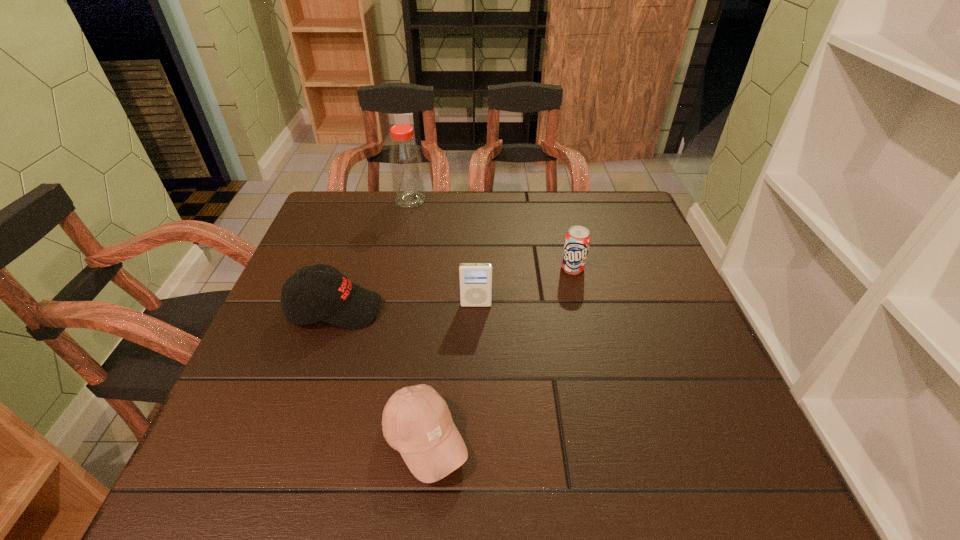
Identify the location of blank space located on the front-facing side of the iPod. (474, 459).

Identify the location of vacant area situated on the front of the rightmost object. (592, 353).

Image resolution: width=960 pixels, height=540 pixels. I want to click on free space located on the front-facing side of the taller baseball cap, so [x=438, y=309].

At what (x,y) coordinates should I click in order to perform the action: click on free space located on the front-facing side of the shortest object. Please return your answer as a coordinate pair (x, y). Image resolution: width=960 pixels, height=540 pixels. Looking at the image, I should click on (644, 440).

The height and width of the screenshot is (540, 960). I want to click on object that is at the far edge, so click(x=405, y=161).

Locate an element on the screen. The width and height of the screenshot is (960, 540). object that is at the near edge is located at coordinates (416, 421).

Where is `object located in the left edge section of the desktop`? Image resolution: width=960 pixels, height=540 pixels. object located in the left edge section of the desktop is located at coordinates (341, 303).

Image resolution: width=960 pixels, height=540 pixels. In order to click on vacant space at the far edge of the desktop in this screenshot , I will do `click(400, 219)`.

Locate an element on the screen. The image size is (960, 540). blank space at the left edge is located at coordinates (285, 425).

Find the location of a particular element. This screenshot has width=960, height=540. free location at the right edge of the desktop is located at coordinates (675, 330).